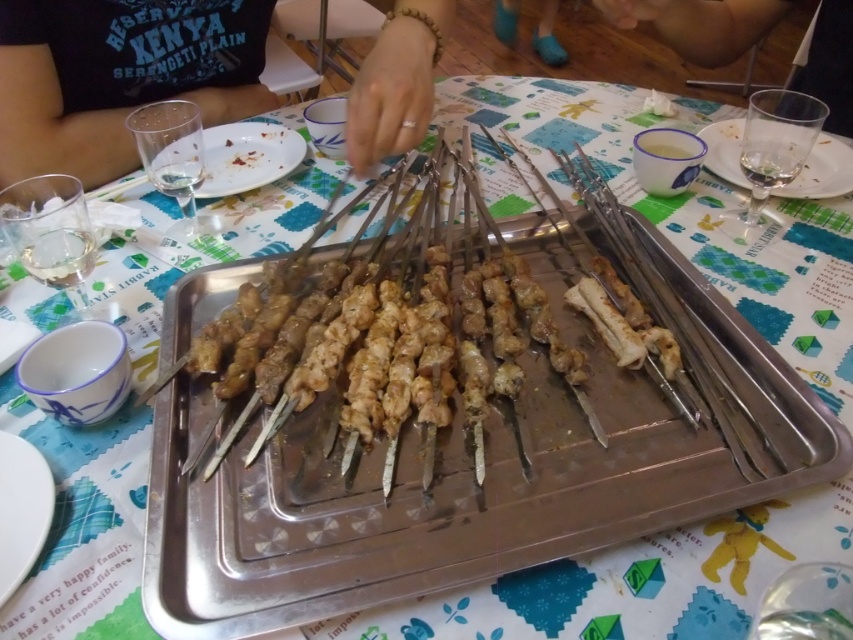
Question: Does brown leather hand at upper right appear on the right side of clear plastic cup at upper left?

Choices:
 (A) yes
 (B) no

Answer: (A)

Question: Which of these objects is positioned closest to the brown matte skewers at center?

Choices:
 (A) brown leather hand at upper right
 (B) clear glass at upper right

Answer: (B)

Question: Where is brown matte skewers at center located in relation to matte black shirt at upper left in the image?

Choices:
 (A) below
 (B) above

Answer: (A)

Question: Among these objects, which one is nearest to the camera?

Choices:
 (A) white ceramic plate at lower left
 (B) clear glass at upper right
 (C) brown matte skewers at center

Answer: (A)

Question: Does brown matte skewers at center have a greater width compared to brown leather hand at upper right?

Choices:
 (A) yes
 (B) no

Answer: (B)

Question: Which point is farther to the camera?

Choices:
 (A) [x=105, y=116]
 (B) [x=838, y=140]

Answer: (A)